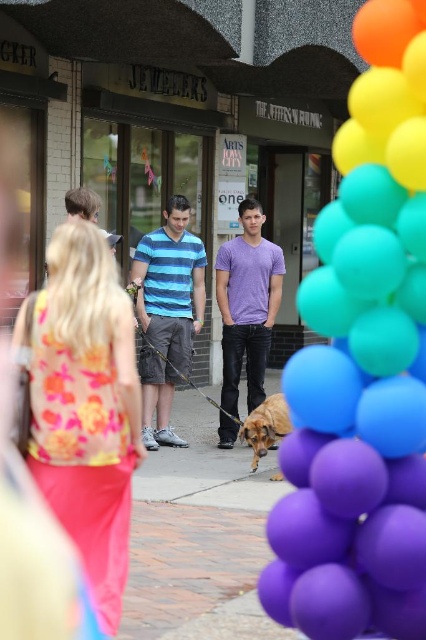
In the festive street scene, there are two men wearing a blue striped shirt at center and a purple matte shirt at center. From the perspective of someone facing the scene, which shirt is positioned to the left?

The blue striped shirt at center is to the left of the purple matte shirt at center.

You are a photographer setting up a tripod to capture the purple matte balloons at right and the brown matte dog at center. Since you want to focus on the balloons first, which object should you adjust your camera angle upwards to capture?

The purple matte balloons at right is much taller than the brown matte dog at center, so you should adjust your camera angle upwards to capture the purple matte balloons at right.